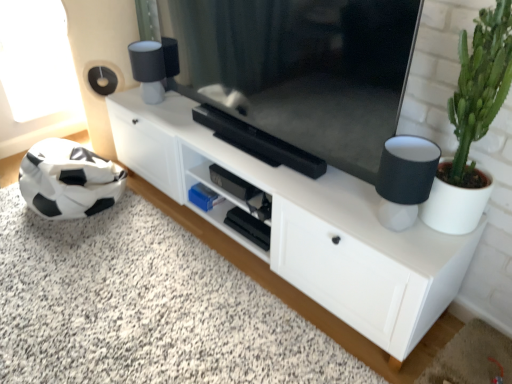
Image resolution: width=512 pixels, height=384 pixels. What are the coordinates of `free space to the left of green succulent at right` in the screenshot? It's located at (385, 228).